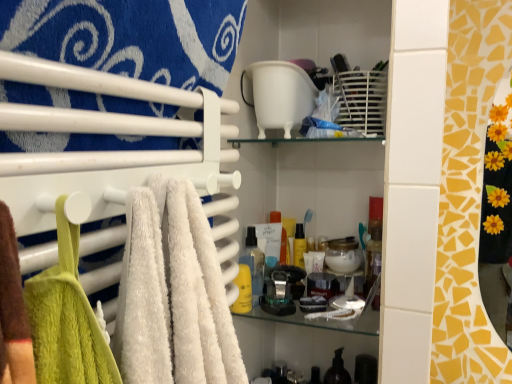
Question: From a real-world perspective, does translucent plastic spray bottle at center, the second toiletry from the front, sit lower than translucent plastic soap dispenser at lower center, which is the first toiletry from bottom to top?

Choices:
 (A) no
 (B) yes

Answer: (A)

Question: From the image's perspective, is translucent plastic spray bottle at center, placed as the third toiletry when sorted from bottom to top, above translucent plastic soap dispenser at lower center, positioned as the 3th toiletry in top-to-bottom order?

Choices:
 (A) no
 (B) yes

Answer: (B)

Question: Can you confirm if translucent plastic spray bottle at center, placed as the third toiletry when sorted from bottom to top, is bigger than translucent plastic soap dispenser at lower center, arranged as the first toiletry when viewed from the back?

Choices:
 (A) no
 (B) yes

Answer: (A)

Question: Considering the relative positions of translucent plastic spray bottle at center, placed as the third toiletry when sorted from bottom to top, and translucent plastic soap dispenser at lower center, which is counted as the 3th toiletry, starting from the left, in the image provided, is translucent plastic spray bottle at center, placed as the third toiletry when sorted from bottom to top, to the right of translucent plastic soap dispenser at lower center, which is counted as the 3th toiletry, starting from the left, from the viewer's perspective?

Choices:
 (A) no
 (B) yes

Answer: (A)

Question: Can you confirm if translucent plastic spray bottle at center, which is the second toiletry from left to right, is shorter than translucent plastic soap dispenser at lower center, positioned as the 3th toiletry in front-to-back order?

Choices:
 (A) yes
 (B) no

Answer: (A)

Question: Is point (200, 142) closer or farther from the camera than point (264, 258)?

Choices:
 (A) farther
 (B) closer

Answer: (B)

Question: From a real-world perspective, is white soft towel at left above or below translucent plastic spray bottle at center, which is the 2th toiletry in back-to-front order?

Choices:
 (A) below
 (B) above

Answer: (B)

Question: Looking at their shapes, would you say white soft towel at left is wider or thinner than translucent plastic spray bottle at center, placed as the third toiletry when sorted from bottom to top?

Choices:
 (A) wide
 (B) thin

Answer: (A)

Question: In terms of height, does white soft towel at left look taller or shorter compared to translucent plastic spray bottle at center, the second toiletry viewed from the right?

Choices:
 (A) short
 (B) tall

Answer: (A)

Question: From the image's perspective, relative to yellow matte bottle at center, arranged as the second toiletry when ordered from the bottom, is translucent plastic soap dispenser at lower center, which is the 1th toiletry from right to left, above or below?

Choices:
 (A) below
 (B) above

Answer: (A)

Question: Considering the positions of translucent plastic soap dispenser at lower center, arranged as the first toiletry when viewed from the back, and yellow matte bottle at center, the third toiletry positioned from the right, in the image, is translucent plastic soap dispenser at lower center, arranged as the first toiletry when viewed from the back, taller or shorter than yellow matte bottle at center, the third toiletry positioned from the right,?

Choices:
 (A) tall
 (B) short

Answer: (A)

Question: Is point (336, 369) positioned closer to the camera than point (245, 271)?

Choices:
 (A) closer
 (B) farther

Answer: (B)

Question: Considering their positions, is translucent plastic soap dispenser at lower center, which is the 1th toiletry from right to left, located in front of or behind yellow matte bottle at center, arranged as the second toiletry when ordered from the bottom?

Choices:
 (A) behind
 (B) front

Answer: (A)

Question: Considering their positions, is yellow matte bottle at center, arranged as the second toiletry when ordered from the bottom, located in front of or behind translucent plastic spray bottle at center, placed as the third toiletry when sorted from bottom to top?

Choices:
 (A) behind
 (B) front

Answer: (B)

Question: Looking at their shapes, would you say yellow matte bottle at center, positioned as the 3th toiletry in back-to-front order, is wider or thinner than translucent plastic spray bottle at center, which is the second toiletry from left to right?

Choices:
 (A) wide
 (B) thin

Answer: (A)